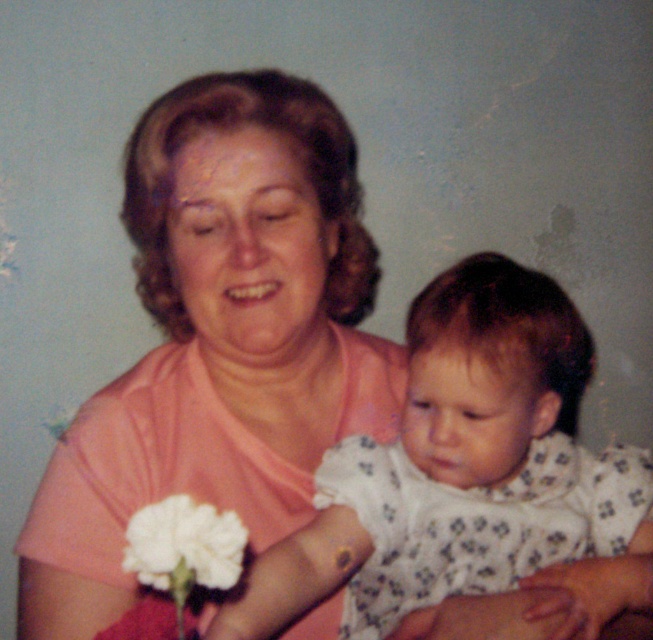
Question: Which point is closer to the camera?

Choices:
 (A) (518, 333)
 (B) (214, 513)

Answer: (B)

Question: Can you confirm if white dotted dress at center is smaller than white matte flower at lower left?

Choices:
 (A) no
 (B) yes

Answer: (A)

Question: Considering the relative positions of white dotted dress at center and white matte flower at lower left in the image provided, where is white dotted dress at center located with respect to white matte flower at lower left?

Choices:
 (A) below
 (B) above

Answer: (A)

Question: Does white dotted dress at center have a larger size compared to white matte flower at lower left?

Choices:
 (A) yes
 (B) no

Answer: (A)